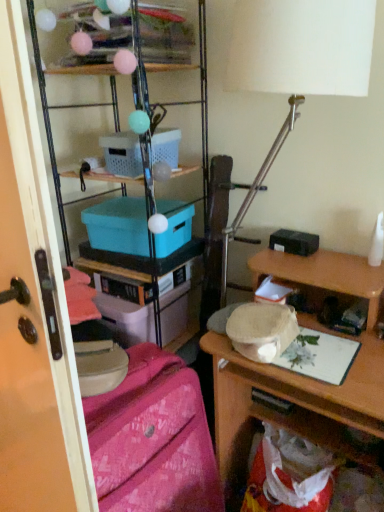
Question: From the image's perspective, is white plastic box at upper center, the first box when ordered from top to bottom, under teal plastic box at center, which is counted as the 2th box, starting from the top?

Choices:
 (A) yes
 (B) no

Answer: (B)

Question: Is white plastic box at upper center, the 2th box from the bottom, looking in the opposite direction of teal plastic box at center, which is counted as the 2th box, starting from the top?

Choices:
 (A) yes
 (B) no

Answer: (B)

Question: Considering the relative sizes of white plastic box at upper center, the 2th box from the bottom, and teal plastic box at center, the 1th box from the bottom, in the image provided, is white plastic box at upper center, the 2th box from the bottom, thinner than teal plastic box at center, the 1th box from the bottom,?

Choices:
 (A) yes
 (B) no

Answer: (A)

Question: Is there a large distance between white plastic box at upper center, the first box when ordered from top to bottom, and teal plastic box at center, which is counted as the 2th box, starting from the top?

Choices:
 (A) no
 (B) yes

Answer: (A)

Question: Can you confirm if white plastic box at upper center, the first box when ordered from top to bottom, is bigger than teal plastic box at center, which is counted as the 2th box, starting from the top?

Choices:
 (A) yes
 (B) no

Answer: (B)

Question: Is matte plastic storage at upper left, the 2th shelf viewed from the top, to the left or to the right of white plastic box at upper center, the first box when ordered from top to bottom, in the image?

Choices:
 (A) left
 (B) right

Answer: (A)

Question: In the image, is matte plastic storage at upper left, the 2th shelf viewed from the top, positioned in front of or behind white plastic box at upper center, the 2th box from the bottom?

Choices:
 (A) behind
 (B) front

Answer: (B)

Question: Considering the positions of matte plastic storage at upper left, the 1th shelf positioned from the bottom, and white plastic box at upper center, the first box when ordered from top to bottom, in the image, is matte plastic storage at upper left, the 1th shelf positioned from the bottom, wider or thinner than white plastic box at upper center, the first box when ordered from top to bottom,?

Choices:
 (A) wide
 (B) thin

Answer: (A)

Question: From their relative heights in the image, would you say matte plastic storage at upper left, the 2th shelf viewed from the top, is taller or shorter than white plastic box at upper center, the first box when ordered from top to bottom?

Choices:
 (A) tall
 (B) short

Answer: (A)

Question: In terms of width, does matte plastic storage at upper left, the 2th shelf viewed from the top, look wider or thinner when compared to white matte table lamp at upper center?

Choices:
 (A) thin
 (B) wide

Answer: (B)

Question: From the image's perspective, is matte plastic storage at upper left, the 1th shelf positioned from the bottom, above or below white matte table lamp at upper center?

Choices:
 (A) above
 (B) below

Answer: (B)

Question: Considering the positions of point (49, 123) and point (284, 38), is point (49, 123) closer or farther from the camera than point (284, 38)?

Choices:
 (A) closer
 (B) farther

Answer: (B)

Question: Relative to white matte table lamp at upper center, is matte plastic storage at upper left, the 1th shelf positioned from the bottom, in front or behind?

Choices:
 (A) front
 (B) behind

Answer: (B)

Question: Is pink fabric suitcase at lower left situated inside matte plastic storage at upper left, the 2th shelf viewed from the top, or outside?

Choices:
 (A) inside
 (B) outside

Answer: (B)

Question: Looking at the image, does pink fabric suitcase at lower left seem bigger or smaller compared to matte plastic storage at upper left, the 2th shelf viewed from the top?

Choices:
 (A) big
 (B) small

Answer: (B)